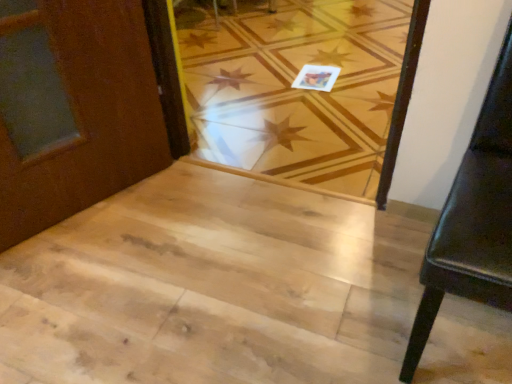
Question: From a real-world perspective, is natural wood floor at center physically located above or below natural wood stairwell at center?

Choices:
 (A) above
 (B) below

Answer: (B)

Question: Is natural wood floor at center wider or thinner than natural wood stairwell at center?

Choices:
 (A) wide
 (B) thin

Answer: (A)

Question: Considering the real-world distances, which object is farthest from the natural wood floor at center?

Choices:
 (A) black leather chair at right
 (B) natural wood stairwell at center

Answer: (A)

Question: Which of these objects is positioned farthest from the natural wood floor at center?

Choices:
 (A) natural wood stairwell at center
 (B) black leather chair at right

Answer: (B)